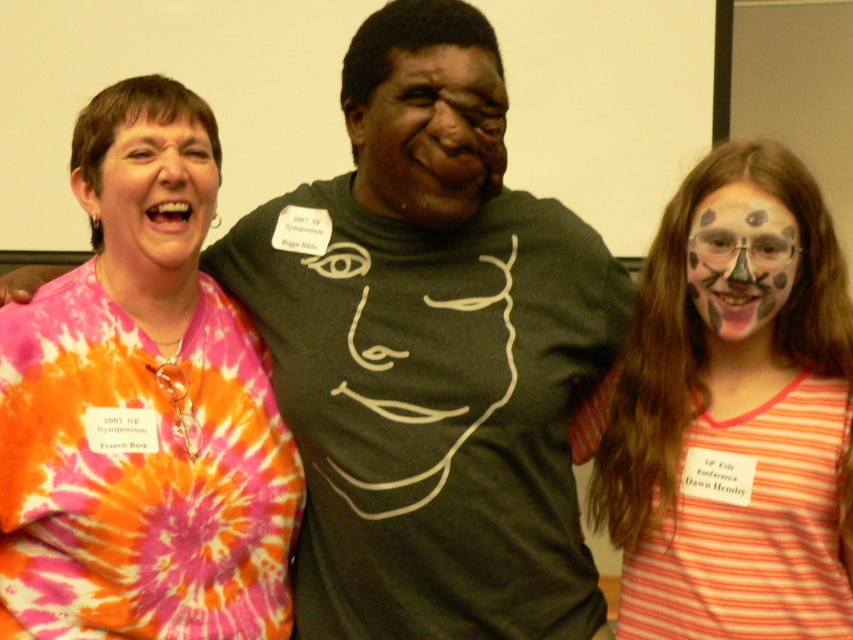
You are a photographer trying to capture a group photo. You need to arrange the matte black face at center and the painted face at right so that they are aligned properly. According to the scene description, which face should be placed to the left of the other?

The matte black face at center should be placed to the left of the painted face at right because the matte black face at center is positioned on the left side of painted face at right.

You are a photographer trying to capture a group photo of Francis Buck and two others. You notice that the striped cotton shirt at right and the matte black face at center are blocking the projection screen in the background. Which object should you move to ensure the screen is visible?

The striped cotton shirt at right is positioned under matte black face at center. To ensure the projection screen is visible, you should move the matte black face at center since it is above the striped cotton shirt at right and likely closer to the camera, thus blocking the screen more prominently.